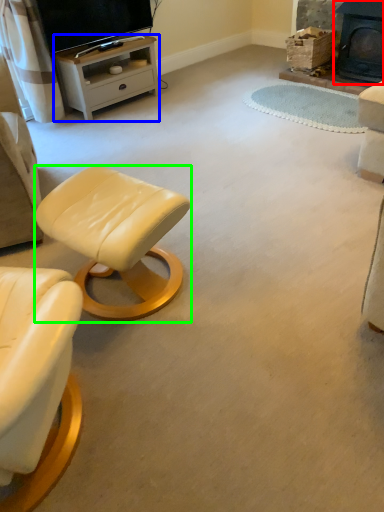
Question: Which object is the closest to the fireplace (highlighted by a red box)? Choose among these: desk (highlighted by a blue box) or stool (highlighted by a green box).

Choices:
 (A) desk
 (B) stool

Answer: (A)